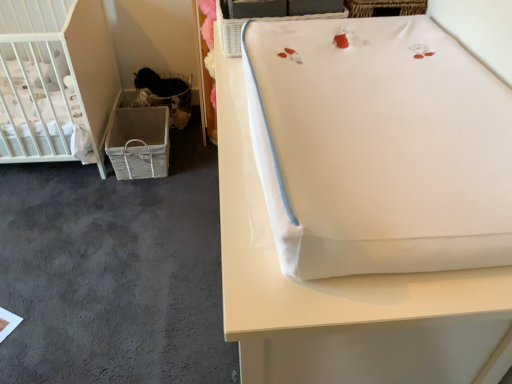
Find the location of a particular element. The width and height of the screenshot is (512, 384). free space in front of woven fabric basket at lower left is located at coordinates (124, 200).